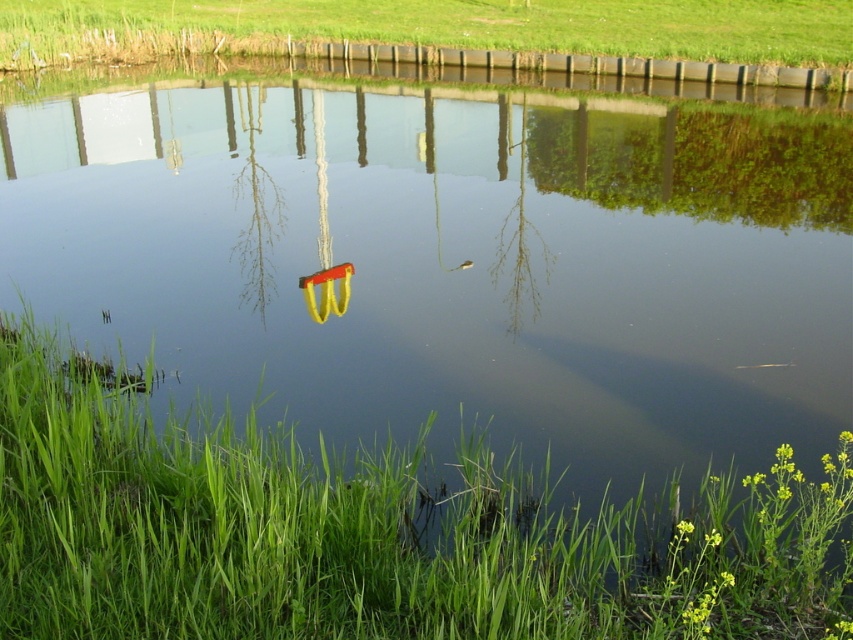
Question: Does green grass at lower left have a larger size compared to green grass at upper center?

Choices:
 (A) yes
 (B) no

Answer: (B)

Question: Which of the following is the closest to the observer?

Choices:
 (A) (77, 4)
 (B) (727, 604)

Answer: (B)

Question: Is green grass at lower left to the left of green grass at upper center from the viewer's perspective?

Choices:
 (A) no
 (B) yes

Answer: (A)

Question: Can you confirm if green grass at lower left is thinner than green grass at upper center?

Choices:
 (A) no
 (B) yes

Answer: (B)

Question: Which object appears farthest from the camera in this image?

Choices:
 (A) green grass at lower left
 (B) green grass at upper center

Answer: (B)